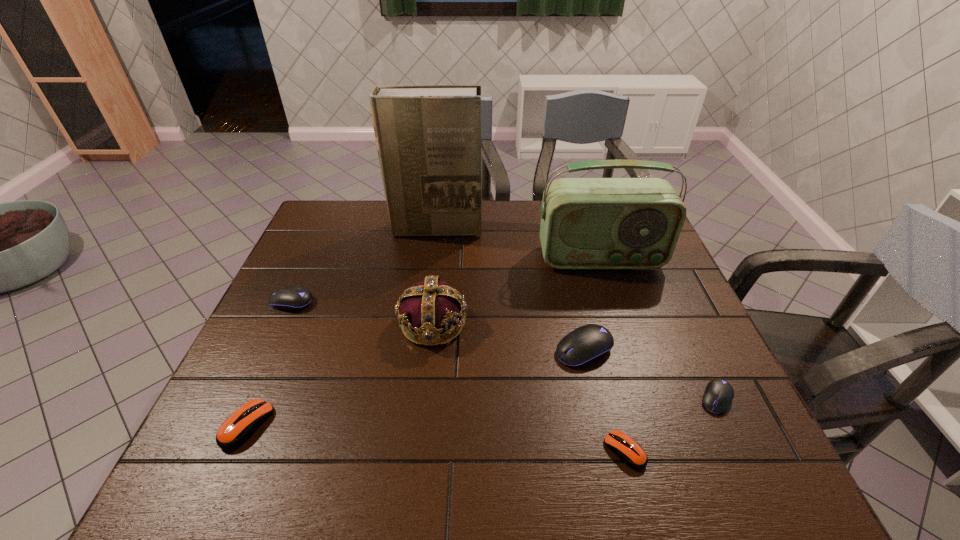
What are the coordinates of `the tallest object` in the screenshot? It's located at (428, 137).

Where is `the farthest object`? the farthest object is located at coordinates (428, 137).

Identify the location of the seventh nearest object. This screenshot has height=540, width=960. (586, 223).

Where is `radio receiver`? The width and height of the screenshot is (960, 540). radio receiver is located at coordinates (586, 223).

Locate an element on the screen. The image size is (960, 540). purple crown is located at coordinates (428, 307).

At what (x,y) coordinates should I click in order to perform the action: click on the third tallest object. Please return your answer as a coordinate pair (x, y). This screenshot has height=540, width=960. Looking at the image, I should click on (428, 307).

Locate an element on the screen. the biggest black computer mouse is located at coordinates (587, 344).

You are a GUI agent. You are given a task and a screenshot of the screen. Output one action in this format:
    pyautogui.click(x=<x>, y=<y>)
    Task: Click on the fifth shortest object
    
    Given the screenshot: What is the action you would take?
    pyautogui.click(x=587, y=344)

At what (x,y) coordinates should I click in order to perform the action: click on the farthest black computer mouse. Please return your answer as a coordinate pair (x, y). Looking at the image, I should click on (291, 298).

Where is `the farthest computer mouse`? Image resolution: width=960 pixels, height=540 pixels. the farthest computer mouse is located at coordinates (291, 298).